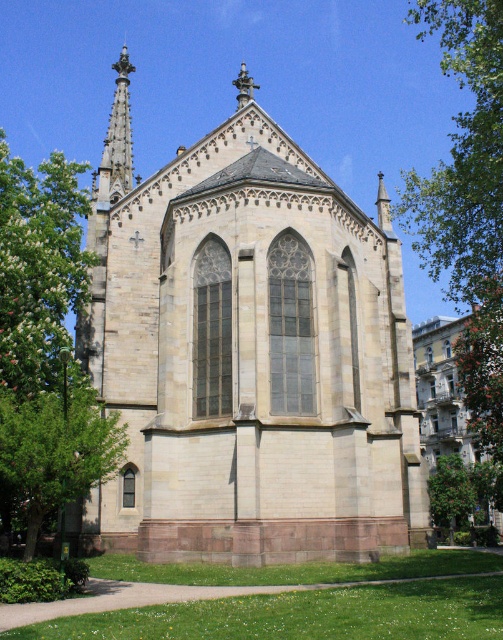
Is beige stone church at center smaller than green leafy tree at upper right?

Yes.

Is beige stone church at center below green leafy tree at upper right?

Yes, beige stone church at center is below green leafy tree at upper right.

Where is `beige stone church at center`? Image resolution: width=503 pixels, height=640 pixels. beige stone church at center is located at coordinates (252, 360).

Find the location of a particular element. This screenshot has width=503, height=640. beige stone church at center is located at coordinates (252, 360).

Is polished stone spire at upper left smaller than green leafy tree at lower right?

No.

Is polished stone spire at upper left shorter than green leafy tree at lower right?

No, polished stone spire at upper left is not shorter than green leafy tree at lower right.

Describe the element at coordinates (118, 138) in the screenshot. Image resolution: width=503 pixels, height=640 pixels. I see `polished stone spire at upper left` at that location.

Where is `polished stone spire at upper left`? polished stone spire at upper left is located at coordinates (118, 138).

Is point (78, 428) positioned in front of point (430, 509)?

Yes.

Who is positioned more to the right, green leafy tree at lower left or green leafy tree at lower right?

green leafy tree at lower right is more to the right.

Does point (27, 401) lie behind point (466, 518)?

No, it is in front of (466, 518).

Find the location of a particular element. The height and width of the screenshot is (640, 503). green leafy tree at lower left is located at coordinates (56, 448).